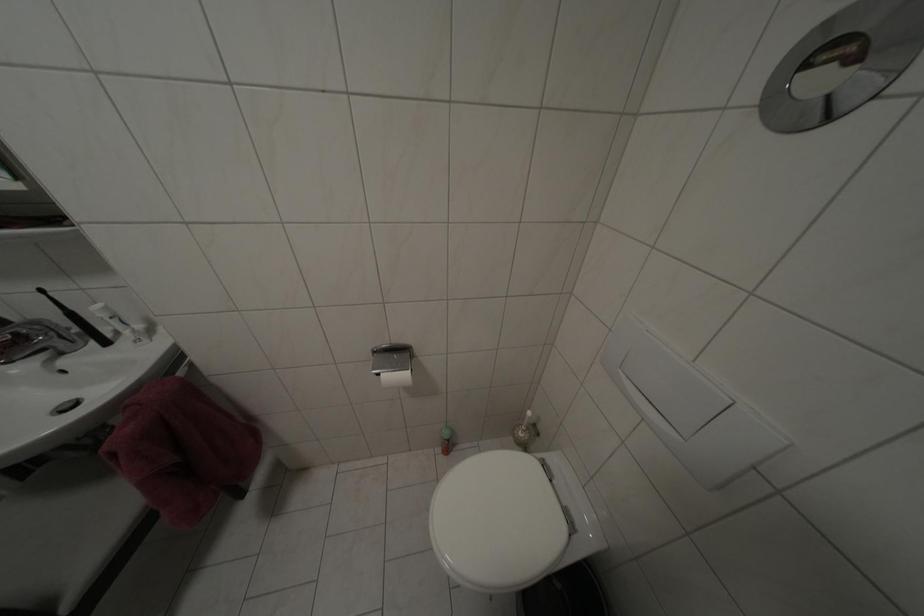
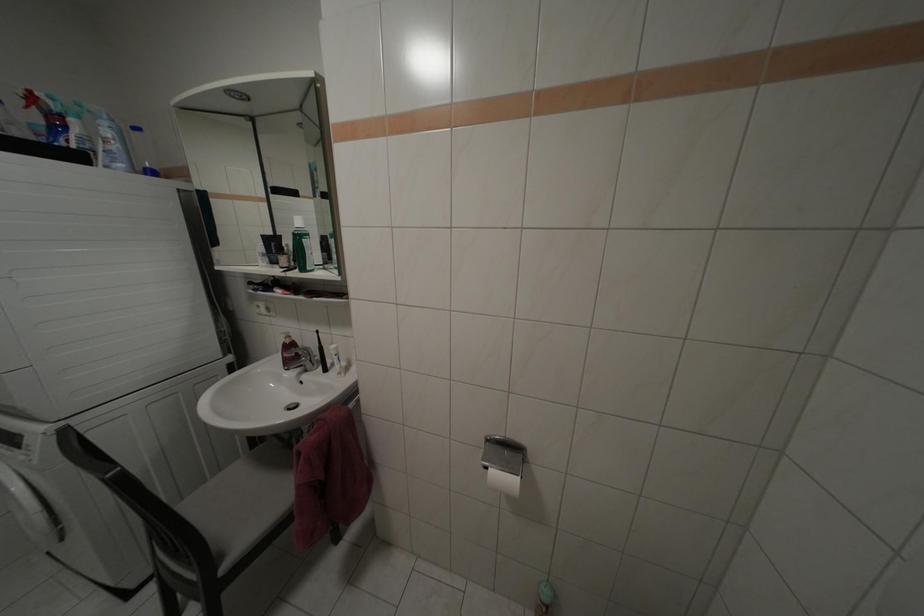
How did the camera likely rotate?

The rotation direction of the camera is left-up.